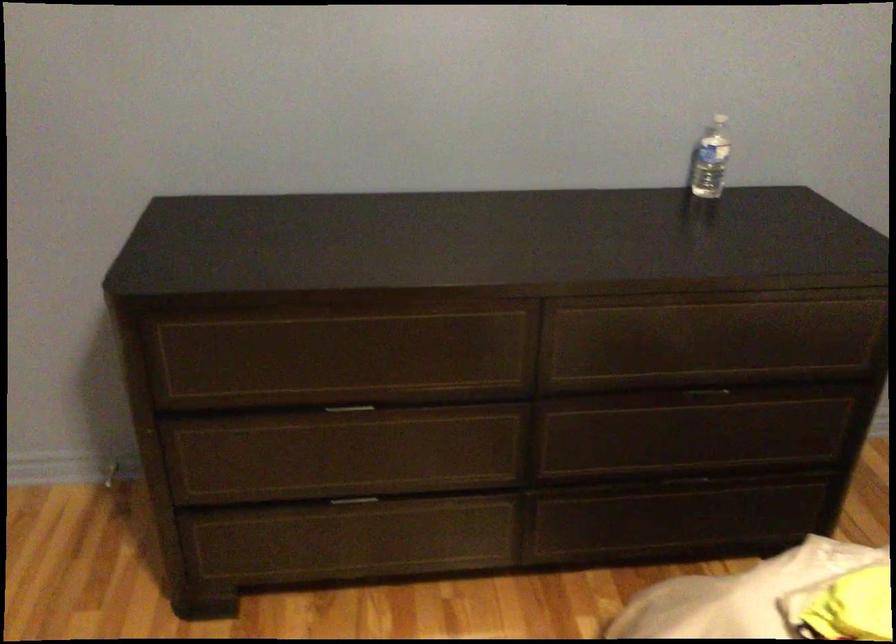
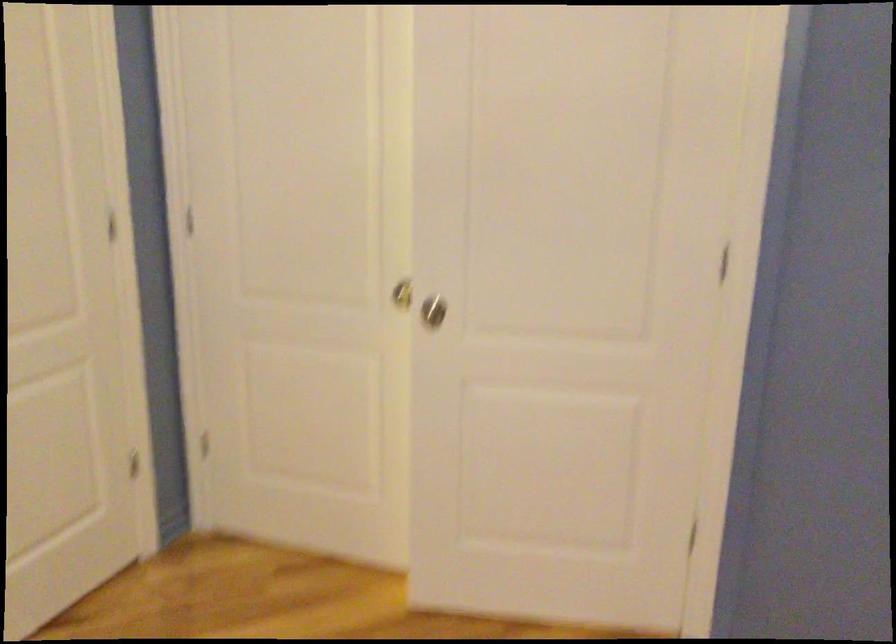
Question: The camera is either moving clockwise (left) or counter-clockwise (right) around the object. The first image is from the beginning of the video and the second image is from the end. Is the camera moving left or right when shooting the video?

Choices:
 (A) Left
 (B) Right

Answer: (B)